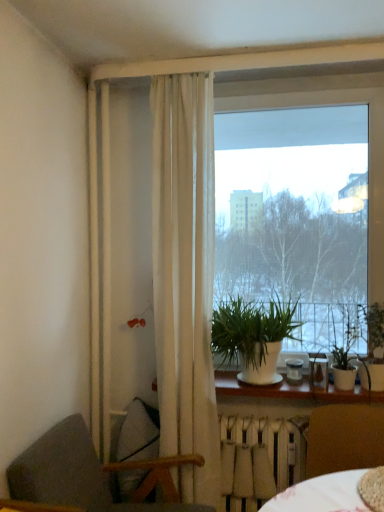
Find the location of a particular element. The image size is (384, 512). empty space that is ontop of transparent glass window at center is located at coordinates (300, 83).